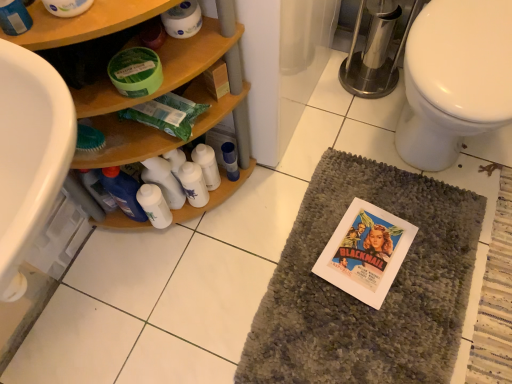
Locate an element on the screen. The width and height of the screenshot is (512, 384). empty space that is in between white glossy toilet at right and gray textured bath mat at center is located at coordinates (486, 226).